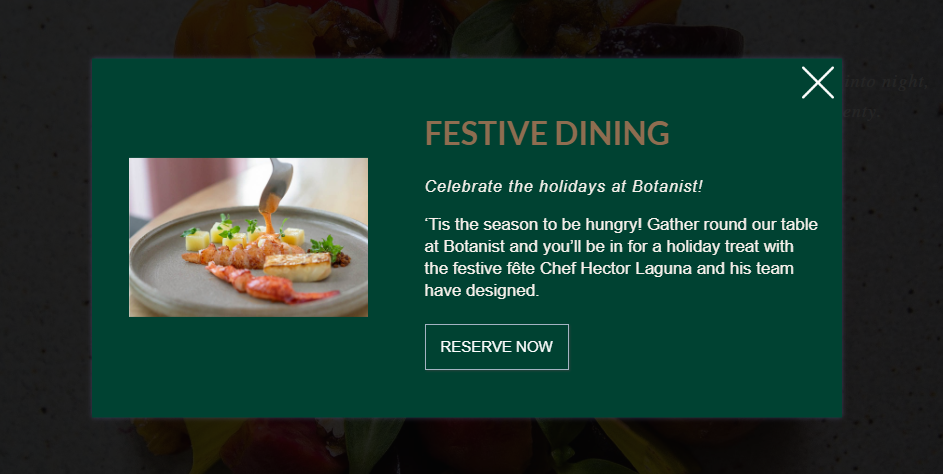
What are the coordinates of `counter top` in the screenshot? It's located at (324, 181).